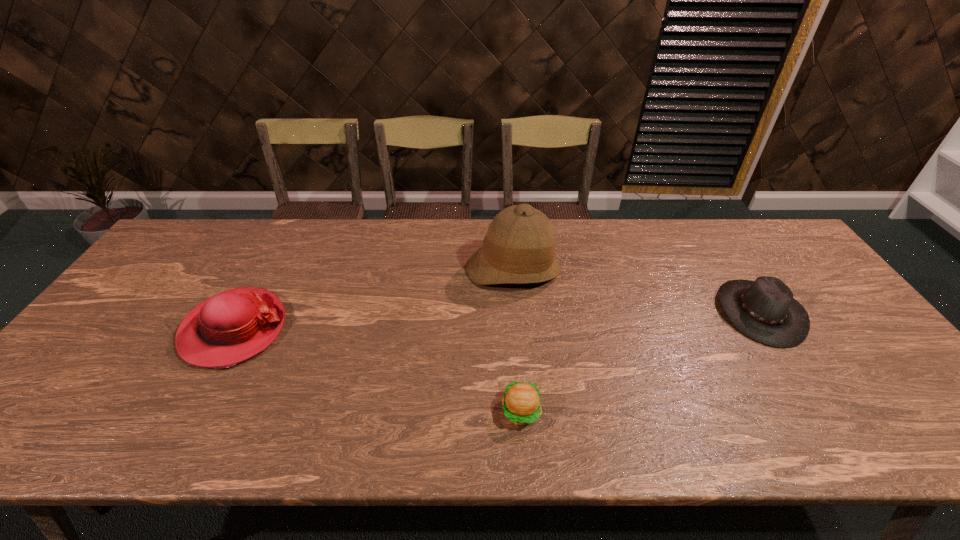
The width and height of the screenshot is (960, 540). I want to click on the tallest hat, so click(x=519, y=248).

This screenshot has width=960, height=540. I want to click on the tallest object, so click(x=519, y=248).

Locate an element on the screen. This screenshot has height=540, width=960. the second tallest hat is located at coordinates (232, 326).

Locate an element on the screen. Image resolution: width=960 pixels, height=540 pixels. the second tallest object is located at coordinates click(x=232, y=326).

This screenshot has width=960, height=540. In order to click on the shortest hat in this screenshot , I will do tap(764, 310).

What are the coordinates of `the second shortest object` in the screenshot? It's located at (764, 310).

Where is `hamburger`? Image resolution: width=960 pixels, height=540 pixels. hamburger is located at coordinates (521, 403).

You are a GUI agent. You are given a task and a screenshot of the screen. Output one action in this format:
    pyautogui.click(x=<x>, y=<y>)
    Task: Click on the shortest object
    This screenshot has width=960, height=540.
    Given the screenshot: What is the action you would take?
    pyautogui.click(x=521, y=403)

Locate an element on the screen. The image size is (960, 540). vacant area situated 0.270m on the front-facing side of the second hat from left to right is located at coordinates (523, 374).

At what (x,y) coordinates should I click in order to perform the action: click on free space located at the front of the leftmost object with a bow. Please return your answer as a coordinate pair (x, y). Image resolution: width=960 pixels, height=540 pixels. Looking at the image, I should click on (327, 329).